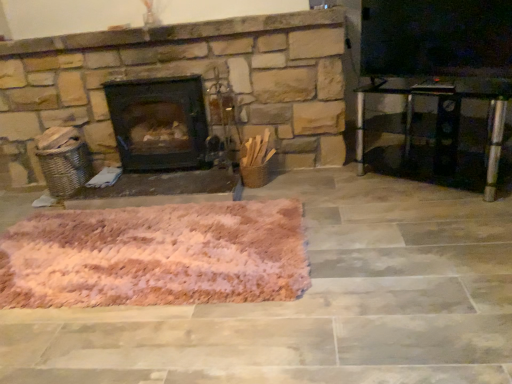
Question: Is pink fluffy rug at center wider than transparent glass table at right?

Choices:
 (A) no
 (B) yes

Answer: (B)

Question: Would you say pink fluffy rug at center is outside transparent glass table at right?

Choices:
 (A) yes
 (B) no

Answer: (A)

Question: Considering the relative sizes of pink fluffy rug at center and transparent glass table at right in the image provided, is pink fluffy rug at center taller than transparent glass table at right?

Choices:
 (A) no
 (B) yes

Answer: (A)

Question: Considering the relative positions of pink fluffy rug at center and transparent glass table at right in the image provided, is pink fluffy rug at center to the left of transparent glass table at right from the viewer's perspective?

Choices:
 (A) yes
 (B) no

Answer: (A)

Question: Is pink fluffy rug at center at the right side of transparent glass table at right?

Choices:
 (A) yes
 (B) no

Answer: (B)

Question: Do you think pink fluffy rug at center is within transparent glass table at right, or outside of it?

Choices:
 (A) outside
 (B) inside

Answer: (A)

Question: Is pink fluffy rug at center bigger or smaller than transparent glass table at right?

Choices:
 (A) small
 (B) big

Answer: (B)

Question: Considering the relative positions of pink fluffy rug at center and transparent glass table at right in the image provided, is pink fluffy rug at center to the left or to the right of transparent glass table at right?

Choices:
 (A) left
 (B) right

Answer: (A)

Question: From the image's perspective, is pink fluffy rug at center positioned above or below transparent glass table at right?

Choices:
 (A) above
 (B) below

Answer: (B)

Question: From the image's perspective, is transparent glass table at right located above or below pink fluffy rug at center?

Choices:
 (A) above
 (B) below

Answer: (A)

Question: Based on their positions, is transparent glass table at right located to the left or right of pink fluffy rug at center?

Choices:
 (A) left
 (B) right

Answer: (B)

Question: Considering their positions, is transparent glass table at right located in front of or behind pink fluffy rug at center?

Choices:
 (A) front
 (B) behind

Answer: (B)

Question: Is transparent glass table at right inside or outside of pink fluffy rug at center?

Choices:
 (A) inside
 (B) outside

Answer: (B)

Question: From their relative heights in the image, would you say transparent glass table at right is taller or shorter than black matte wood burning stove at center?

Choices:
 (A) tall
 (B) short

Answer: (B)

Question: Considering their positions, is transparent glass table at right located in front of or behind black matte wood burning stove at center?

Choices:
 (A) front
 (B) behind

Answer: (A)